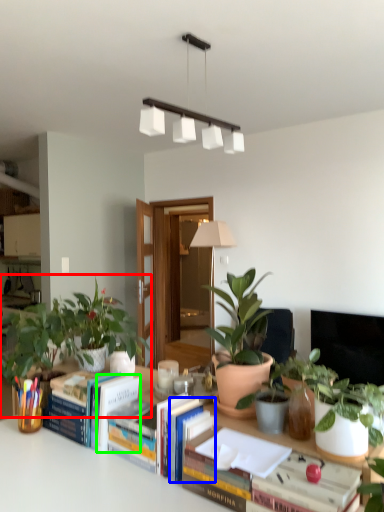
Question: Which object is the farthest from houseplant (highlighted by a red box)? Choose among these: paperback book (highlighted by a blue box) or paperback book (highlighted by a green box).

Choices:
 (A) paperback book
 (B) paperback book

Answer: (A)